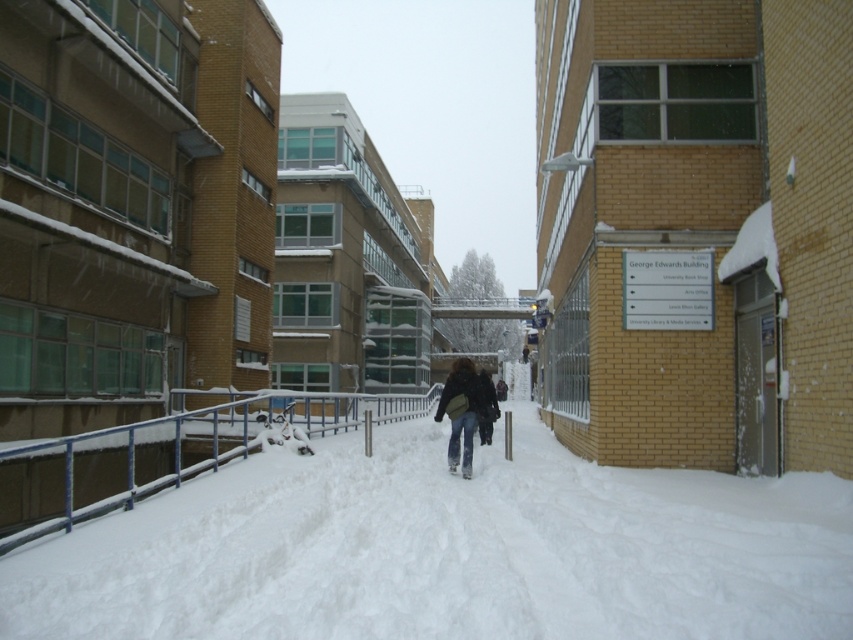
Question: Can you confirm if white powdery snow at center is bigger than blue painted metal railing at lower center?

Choices:
 (A) yes
 (B) no

Answer: (B)

Question: Which object is closer to the camera taking this photo?

Choices:
 (A) white powdery snow at center
 (B) denim jacket at center
 (C) blue painted metal railing at lower center

Answer: (A)

Question: Which of the following is the closest to the observer?

Choices:
 (A) click(x=108, y=500)
 (B) click(x=654, y=563)
 (C) click(x=462, y=380)

Answer: (B)

Question: Among these points, which one is farthest from the camera?

Choices:
 (A) (636, 572)
 (B) (445, 385)
 (C) (233, 397)

Answer: (C)

Question: Can you confirm if white powdery snow at center is positioned above denim jacket at center?

Choices:
 (A) no
 (B) yes

Answer: (A)

Question: Does white powdery snow at center have a larger size compared to blue painted metal railing at lower center?

Choices:
 (A) no
 (B) yes

Answer: (A)